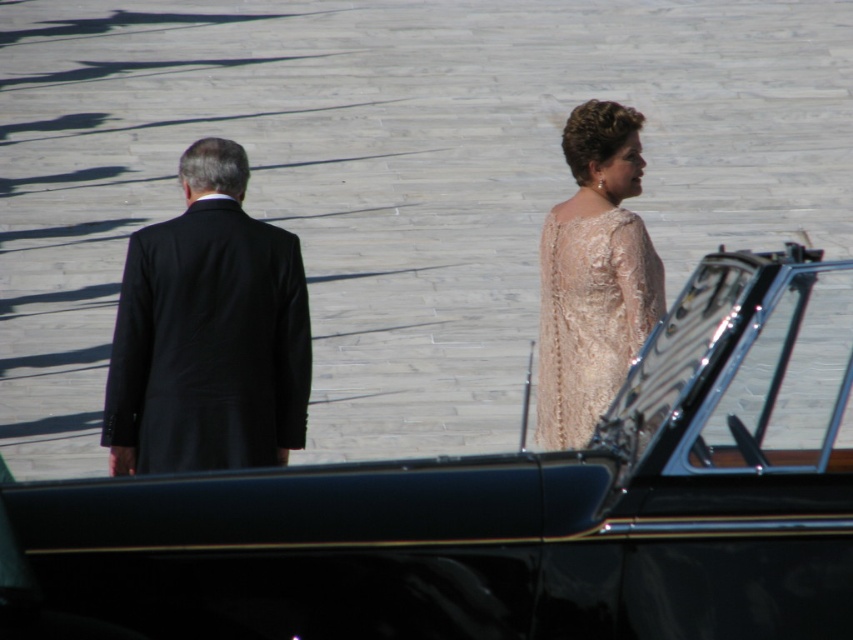
You are a photographer planning to take a photo of the ivory lace dress at right and the black glossy car at center. Since the car is larger, where should you position yourself to make both subjects appear balanced in the frame?

To balance the ivory lace dress at right and the black glossy car at center in the frame, position yourself closer to the ivory lace dress at right since the black glossy car at center is larger. This will help both subjects appear proportionally sized in the photo.

You are standing at the center of the paved area and want to find the black smooth suit at left. Which direction should you look to locate it?

You should look to your left to locate the black smooth suit at left since it is positioned at the left side of the scene.

You are a photographer setting up for a group photo. You see the black smooth suit at left and the ivory lace dress at right. Which person should you adjust their position to ensure both are in focus? Explain your reasoning based on their positions.

The black smooth suit at left is closer to you than the ivory lace dress at right. To ensure both are in focus, you should move the person in the ivory lace dress at right forward to align their distance with the person in the black smooth suit at left.